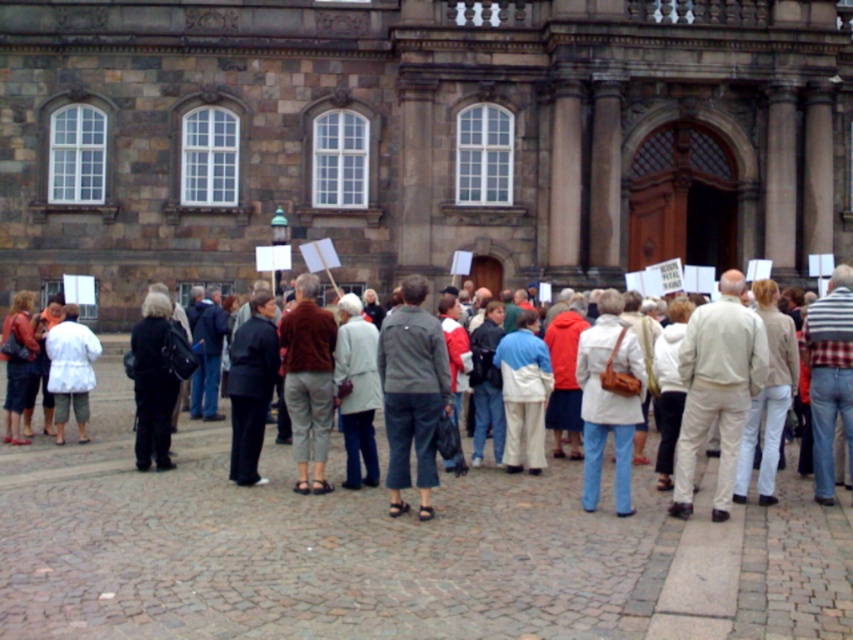
In the scene shown: You are standing at point (421, 396) and want to walk to the historic building. Is point (718, 467) in your path?

Point (718, 467) is behind point (421, 396), so it is not in your path to the historic building.

In the scene shown: You are a photographer trying to capture a photo of the beige cotton pants at right and the white matte jacket at lower left. Which object should you focus on first if you want to ensure both are in sharp focus, considering their heights?

The beige cotton pants at right has a greater height compared to the white matte jacket at lower left. To ensure both are in sharp focus, you should focus on the beige cotton pants at right first, as it is taller and likely farther away, requiring a smaller aperture or adjusting the focus point accordingly.

Where is the beige cotton pants at right located in the image?

The beige cotton pants at right is located at point (x=717, y=388) in the image.